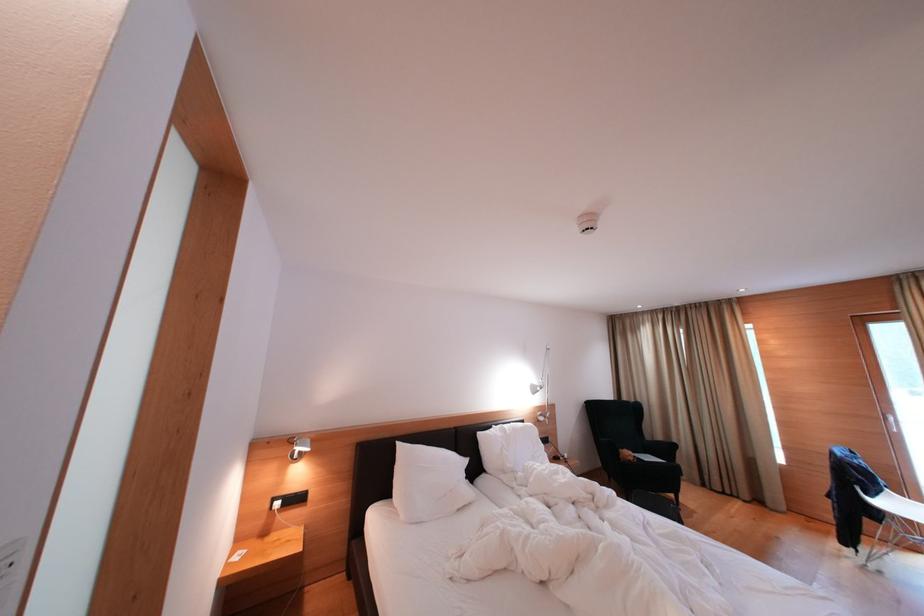
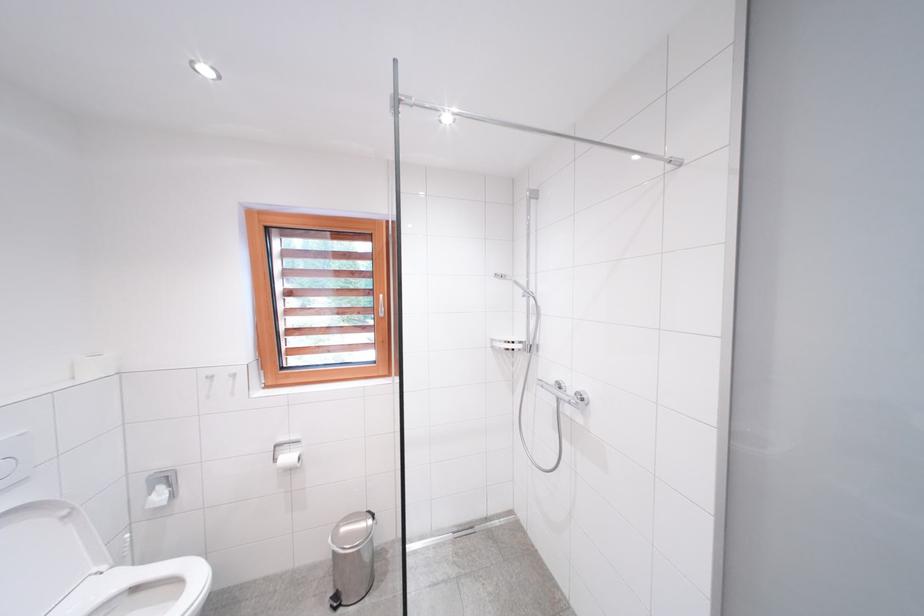
Question: What movement of the cameraman would produce the second image?

Choices:
 (A) Left
 (B) Right
 (C) Forward
 (D) Backward

Answer: (A)